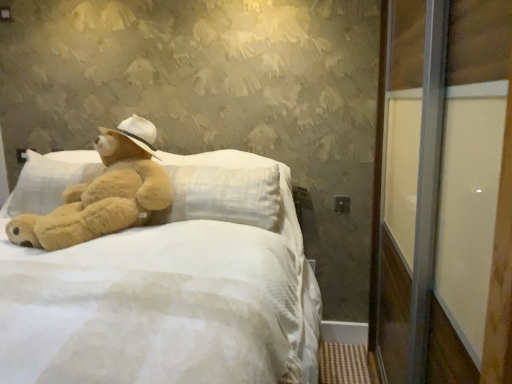
What do you see at coordinates (103, 193) in the screenshot?
I see `fuzzy beige teddy bear at left` at bounding box center [103, 193].

Find the location of a particular element. This screenshot has width=512, height=384. transparent glass screen door at right is located at coordinates (443, 188).

The image size is (512, 384). I want to click on soft white fabric bed at center, so click(166, 301).

In order to click on fuzzy beige teddy bear at left in this screenshot , I will do `click(103, 193)`.

Is the surface of fuzzy beige teddy bear at left in direct contact with transparent glass screen door at right?

No, fuzzy beige teddy bear at left is not next to transparent glass screen door at right.

What's the angular difference between fuzzy beige teddy bear at left and transparent glass screen door at right's facing directions?

fuzzy beige teddy bear at left and transparent glass screen door at right are facing 64.2 degrees away from each other.

Which object is wider, fuzzy beige teddy bear at left or transparent glass screen door at right?

With larger width is transparent glass screen door at right.

From the image's perspective, which object appears higher, fuzzy beige teddy bear at left or transparent glass screen door at right?

fuzzy beige teddy bear at left, from the image's perspective.

Can you tell me how much transparent glass screen door at right and soft white fabric bed at center differ in facing direction?

They differ by 87.5 degrees in their facing directions.

Is transparent glass screen door at right located outside soft white fabric bed at center?

Absolutely, transparent glass screen door at right is external to soft white fabric bed at center.

From the image's perspective, which is below, transparent glass screen door at right or soft white fabric bed at center?

soft white fabric bed at center is shown below in the image.

Which is more to the right, transparent glass screen door at right or soft white fabric bed at center?

Positioned to the right is transparent glass screen door at right.

Does point (303, 261) come farther from viewer compared to point (448, 165)?

Yes, it is behind point (448, 165).

Could you tell me if soft white fabric bed at center is facing transparent glass screen door at right?

No, soft white fabric bed at center is not oriented towards transparent glass screen door at right.

From the image's perspective, is soft white fabric bed at center located above transparent glass screen door at right?

Incorrect, from the image's perspective, soft white fabric bed at center is lower than transparent glass screen door at right.

Who is shorter, soft white fabric bed at center or transparent glass screen door at right?

soft white fabric bed at center.

Who is taller, soft white fabric bed at center or fuzzy beige teddy bear at left?

soft white fabric bed at center is taller.

Can you tell me how much soft white fabric bed at center and fuzzy beige teddy bear at left differ in facing direction?

The facing directions of soft white fabric bed at center and fuzzy beige teddy bear at left are 23.3 degrees apart.

Considering the relative positions of soft white fabric bed at center and fuzzy beige teddy bear at left in the image provided, is soft white fabric bed at center to the right of fuzzy beige teddy bear at left from the viewer's perspective?

Yes, soft white fabric bed at center is to the right of fuzzy beige teddy bear at left.

Does point (165, 173) come behind point (218, 247)?

That is True.

Is fuzzy beige teddy bear at left at the left side of soft white fabric bed at center?

Indeed, fuzzy beige teddy bear at left is positioned on the left side of soft white fabric bed at center.

Can soft white fabric bed at center be found inside fuzzy beige teddy bear at left?

No.

From a real-world perspective, which is physically below, fuzzy beige teddy bear at left or soft white fabric bed at center?

From a 3D spatial view, soft white fabric bed at center is below.

How distant is transparent glass screen door at right from fuzzy beige teddy bear at left?

3.71 feet.

From the image's perspective, is transparent glass screen door at right above or below fuzzy beige teddy bear at left?

From the image's perspective, transparent glass screen door at right appears below fuzzy beige teddy bear at left.

Considering their positions, is transparent glass screen door at right located in front of or behind fuzzy beige teddy bear at left?

transparent glass screen door at right is positioned closer to the viewer than fuzzy beige teddy bear at left.

How many degrees apart are the facing directions of transparent glass screen door at right and fuzzy beige teddy bear at left?

The angular difference between transparent glass screen door at right and fuzzy beige teddy bear at left is 64.2 degrees.

The image size is (512, 384). Find the location of `teddy bear above the transparent glass screen door at right (from a real-world perspective)`. teddy bear above the transparent glass screen door at right (from a real-world perspective) is located at coordinates (103, 193).

Find the location of `screen door on the right of soft white fabric bed at center`. screen door on the right of soft white fabric bed at center is located at coordinates (443, 188).

Considering their positions, is fuzzy beige teddy bear at left positioned further to transparent glass screen door at right than soft white fabric bed at center?

Among the two, fuzzy beige teddy bear at left is located further to transparent glass screen door at right.

Consider the image. From the image, which object appears to be nearer to soft white fabric bed at center, transparent glass screen door at right or fuzzy beige teddy bear at left?

fuzzy beige teddy bear at left is closer to soft white fabric bed at center.

When comparing their distances from fuzzy beige teddy bear at left, does transparent glass screen door at right or soft white fabric bed at center seem further?

transparent glass screen door at right is further to fuzzy beige teddy bear at left.

Considering their positions, is fuzzy beige teddy bear at left positioned closer to soft white fabric bed at center than transparent glass screen door at right?

fuzzy beige teddy bear at left is closer to soft white fabric bed at center.

Estimate the real-world distances between objects in this image. Which object is further from transparent glass screen door at right, soft white fabric bed at center or fuzzy beige teddy bear at left?

fuzzy beige teddy bear at left is further to transparent glass screen door at right.

Looking at the image, which one is located closer to fuzzy beige teddy bear at left, soft white fabric bed at center or transparent glass screen door at right?

soft white fabric bed at center lies closer to fuzzy beige teddy bear at left than the other object.

I want to click on bed between fuzzy beige teddy bear at left and transparent glass screen door at right, so click(x=166, y=301).